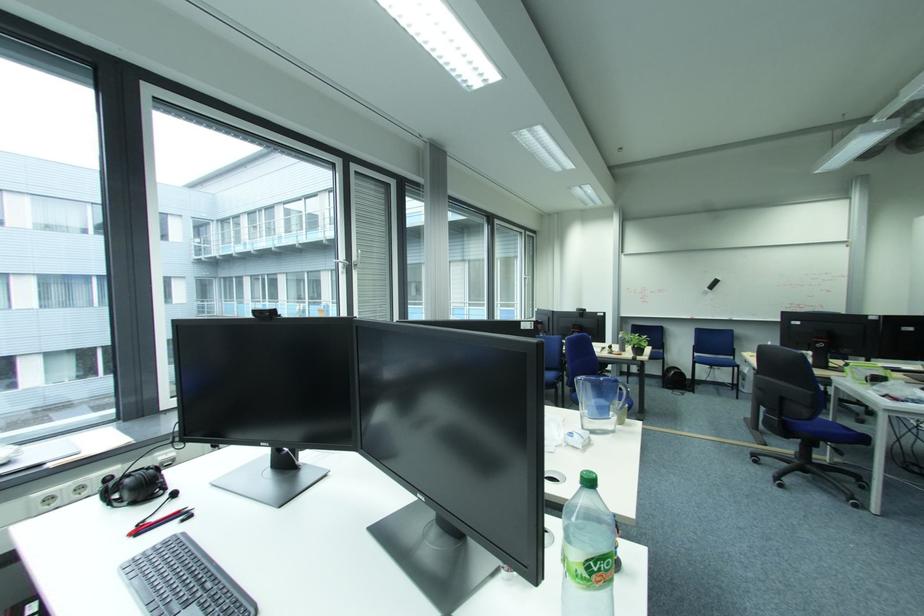
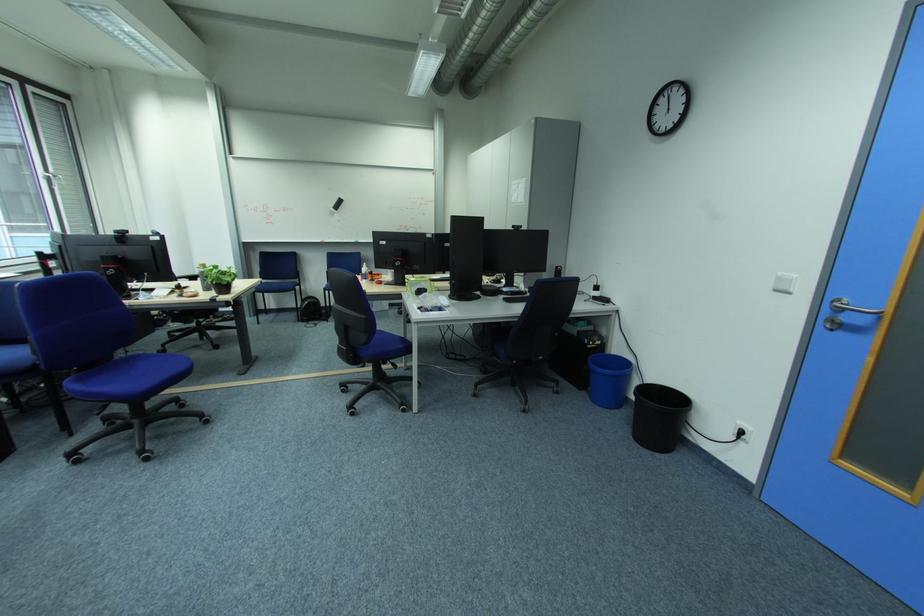
Find the pixel in the second image that matches pixel 819 419 in the first image.

(375, 344)